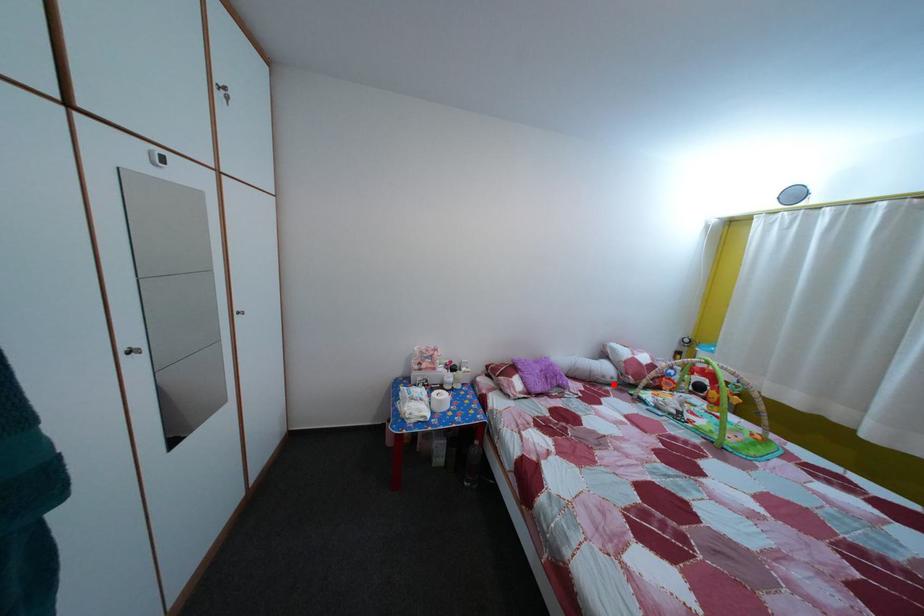
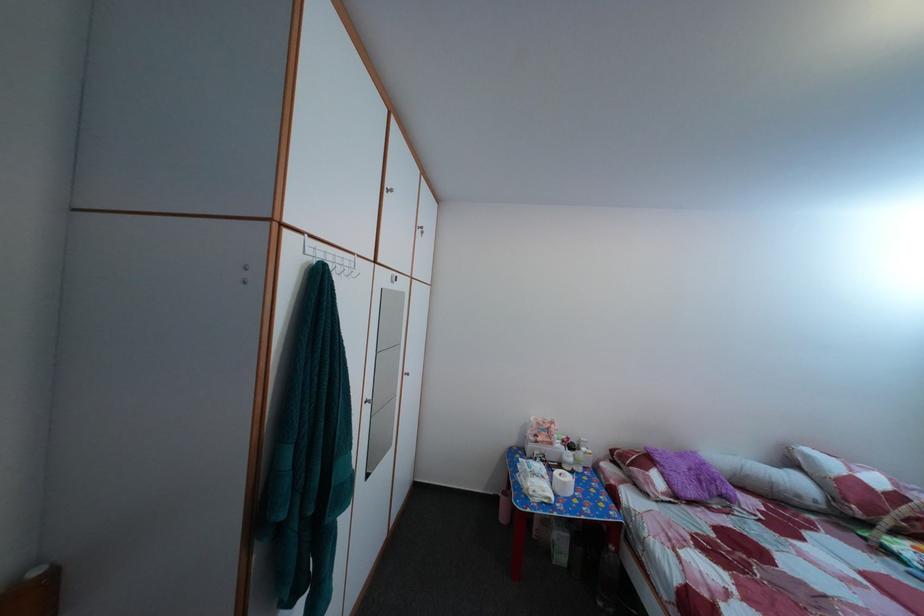
Question: I am providing you with two images of the same scene from different viewpoints. In image1, a red point is highlighted. Considering the same 3D point in image2, which of the following is correct?

Choices:
 (A) It is closer
 (B) It is farther

Answer: (A)